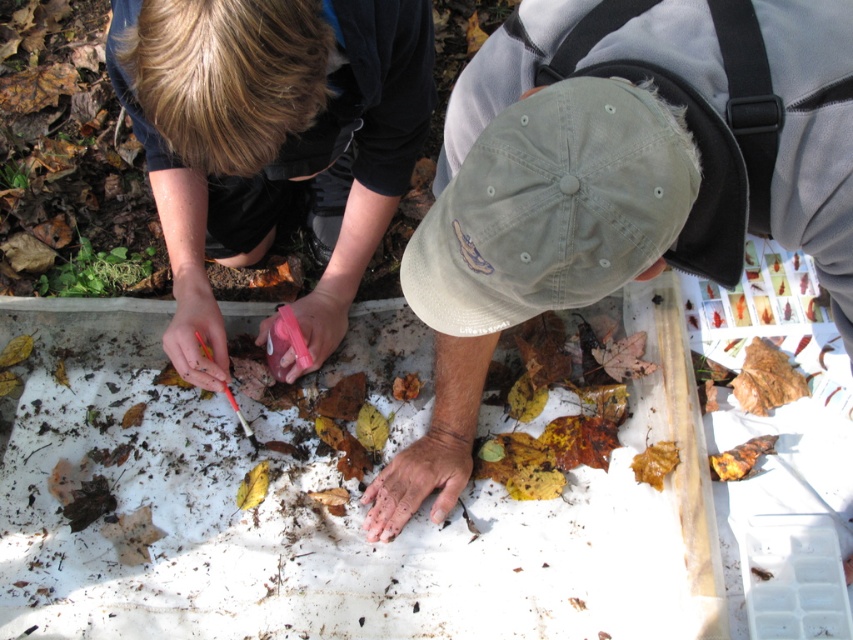
Question: Observing the image, what is the correct spatial positioning of smooth black shirt at upper left in reference to smooth plastic spoon at lower left?

Choices:
 (A) right
 (B) left

Answer: (A)

Question: Can you confirm if khaki cotton cap at center is wider than smooth black shirt at upper left?

Choices:
 (A) no
 (B) yes

Answer: (B)

Question: Which of the following is the closest to the observer?

Choices:
 (A) (178, 282)
 (B) (824, 244)
 (C) (440, 435)
 (D) (688, 189)

Answer: (D)

Question: Which point is farther from the camera taking this photo?

Choices:
 (A) 438,476
 (B) 328,301
 (C) 415,276

Answer: (B)

Question: Where is dry dirt at center located in relation to rubberized plastic spoon at center in the image?

Choices:
 (A) above
 (B) below

Answer: (B)

Question: Which of the following is the farthest from the observer?

Choices:
 (A) (253, 125)
 (B) (184, 378)
 (C) (555, 275)

Answer: (B)